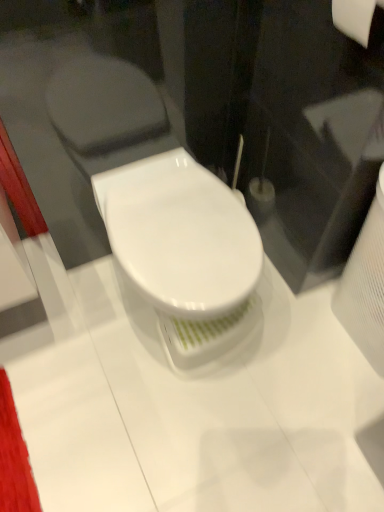
Question: Based on their positions, is white glossy toilet at center located to the left or right of white matte toilet paper at upper right?

Choices:
 (A) right
 (B) left

Answer: (B)

Question: From the image's perspective, is white glossy toilet at center located above or below white matte toilet paper at upper right?

Choices:
 (A) below
 (B) above

Answer: (A)

Question: Relative to white matte toilet paper at upper right, is white glossy toilet at center in front or behind?

Choices:
 (A) behind
 (B) front

Answer: (A)

Question: From the image's perspective, is white matte toilet paper at upper right positioned above or below white glossy toilet at center?

Choices:
 (A) above
 (B) below

Answer: (A)

Question: Would you say white matte toilet paper at upper right is inside or outside white glossy toilet at center?

Choices:
 (A) outside
 (B) inside

Answer: (A)

Question: From a real-world perspective, is white matte toilet paper at upper right physically located above or below white glossy toilet at center?

Choices:
 (A) below
 (B) above

Answer: (B)

Question: Does point (344, 18) appear closer or farther from the camera than point (177, 268)?

Choices:
 (A) closer
 (B) farther

Answer: (A)